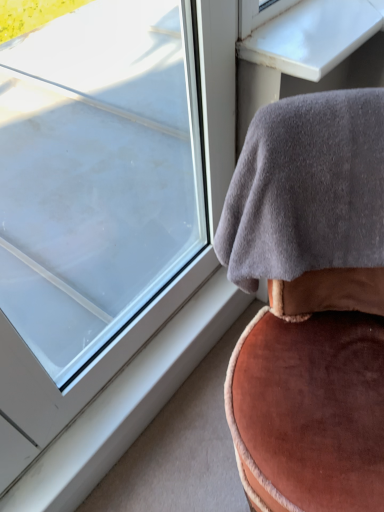
Image resolution: width=384 pixels, height=512 pixels. What are the coordinates of `free point above white plastic window sill at lower left (from a real-world perspective)` in the screenshot? It's located at (132, 376).